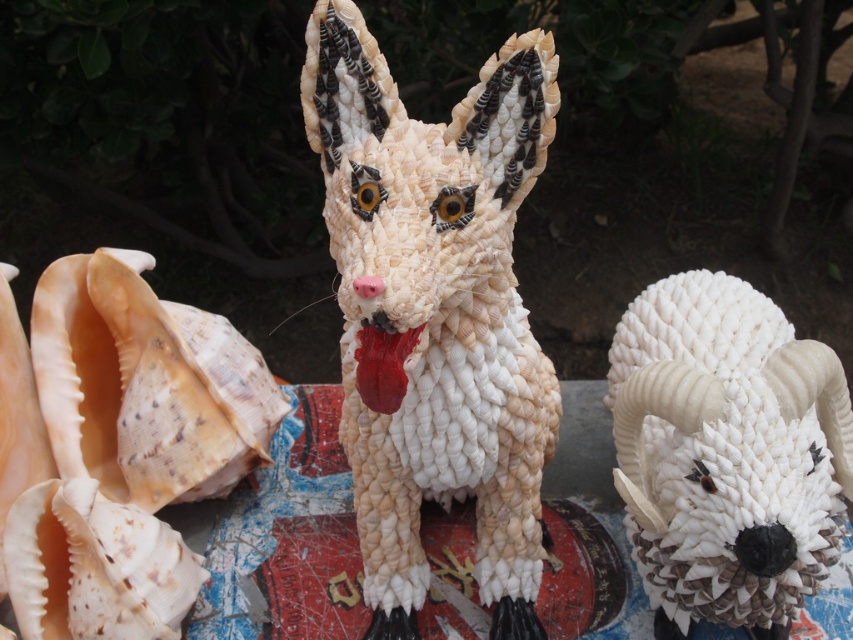
Based on the scene description, what object is located at the coordinates point (115, 445)?

The point (115, 445) corresponds to the natural seashell conch at left.

You are an art curator examining the display. You need to place a protective glass cover over the white shell figurine at center and the natural seashell conch at left. Which object should you cover first if you start from the front of the display?

The white shell figurine at center should be covered first because it is closer to the viewer than the natural seashell conch at left.